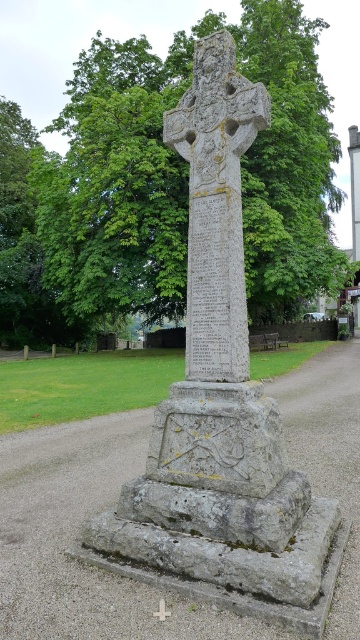
You are standing in a park and see a green leafy tree at center and a granite cross at center. Which object is closer to you?

The green leafy tree at center is closer to you than the granite cross at center because it is further to the viewer.

You are an architect designing a new memorial and are comparing two existing monuments in the park. You see a granite cross at center and a white stone cross at center. Which of these two crosses is wider?

The granite cross at center is wider than the white stone cross at center according to the description provided.